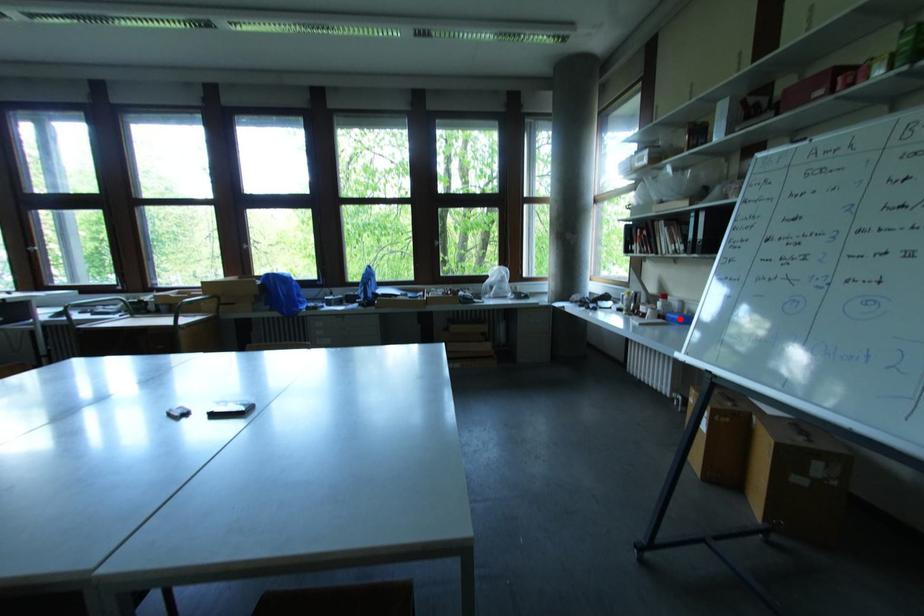
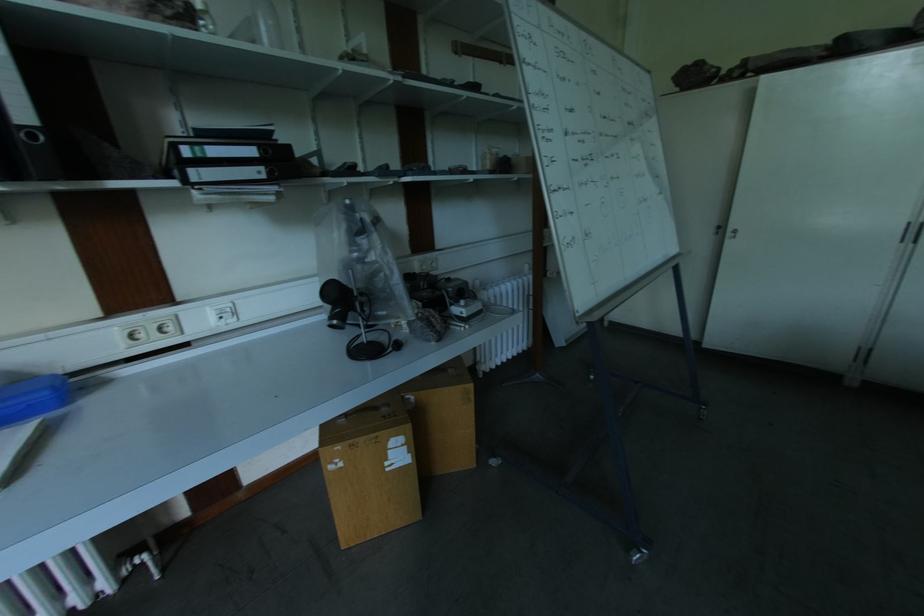
The point at the highlighted location is marked in the first image. Where is the corresponding point in the second image?

(46, 395)